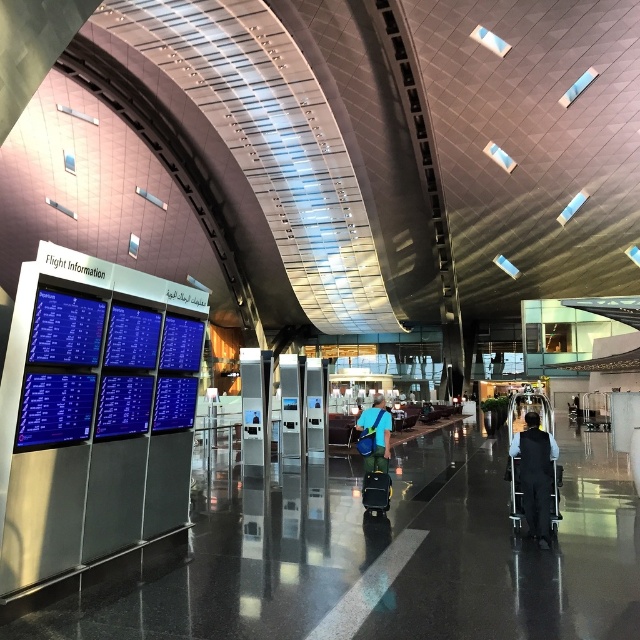
Which is in front, point (388, 435) or point (378, 474)?

Point (378, 474) is in front.

Does blue fabric backpack at center have a greater height compared to black textured suitcase at center?

Indeed, blue fabric backpack at center has a greater height compared to black textured suitcase at center.

Between point (371, 465) and point (369, 500), which one is positioned in front?

Point (369, 500)

Where is `blue fabric backpack at center`? The width and height of the screenshot is (640, 640). blue fabric backpack at center is located at coordinates (376, 435).

Is point (550, 481) in front of point (381, 440)?

Yes, point (550, 481) is in front of point (381, 440).

Is dark blue uniform at center thinner than blue fabric backpack at center?

Yes, dark blue uniform at center is thinner than blue fabric backpack at center.

This screenshot has height=640, width=640. I want to click on dark blue uniform at center, so click(x=536, y=476).

Who is more distant from viewer, (529, 506) or (387, 490)?

The point (387, 490) is behind.

Who is taller, dark blue uniform at center or black textured suitcase at center?

dark blue uniform at center is taller.

This screenshot has height=640, width=640. Describe the element at coordinates (536, 476) in the screenshot. I see `dark blue uniform at center` at that location.

Identify the location of dark blue uniform at center. The width and height of the screenshot is (640, 640). pyautogui.click(x=536, y=476).